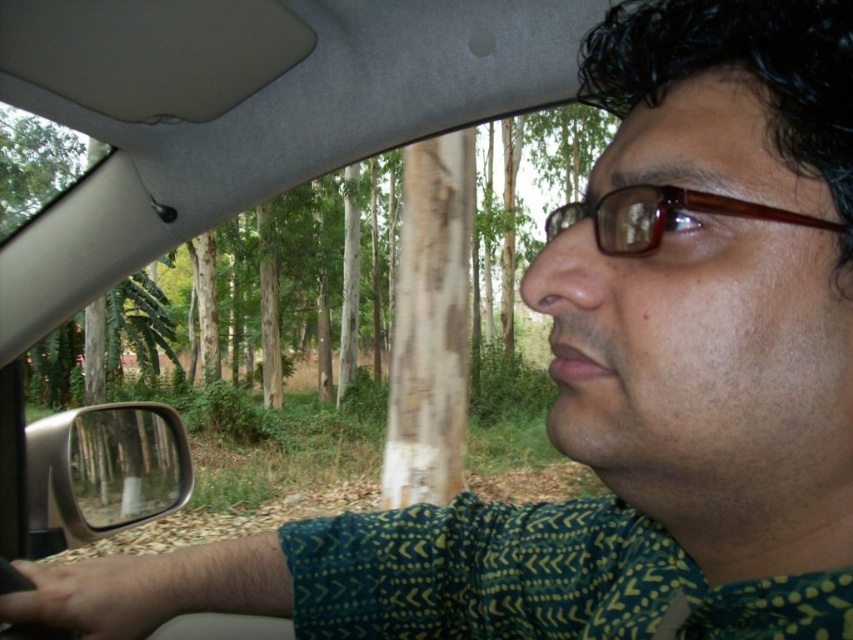
Question: Is clear plastic mirror at left to the right of brown plastic glasses at upper center from the viewer's perspective?

Choices:
 (A) yes
 (B) no

Answer: (B)

Question: Which point appears closest to the camera in this image?

Choices:
 (A) (117, 451)
 (B) (640, 209)

Answer: (B)

Question: From the image, what is the correct spatial relationship of clear plastic mirror at left in relation to brown plastic glasses at upper center?

Choices:
 (A) left
 (B) right

Answer: (A)

Question: Is clear plastic mirror at left below brown plastic glasses at upper center?

Choices:
 (A) no
 (B) yes

Answer: (B)

Question: Which of the following is the closest to the observer?

Choices:
 (A) brown plastic glasses at upper center
 (B) clear plastic mirror at left

Answer: (A)